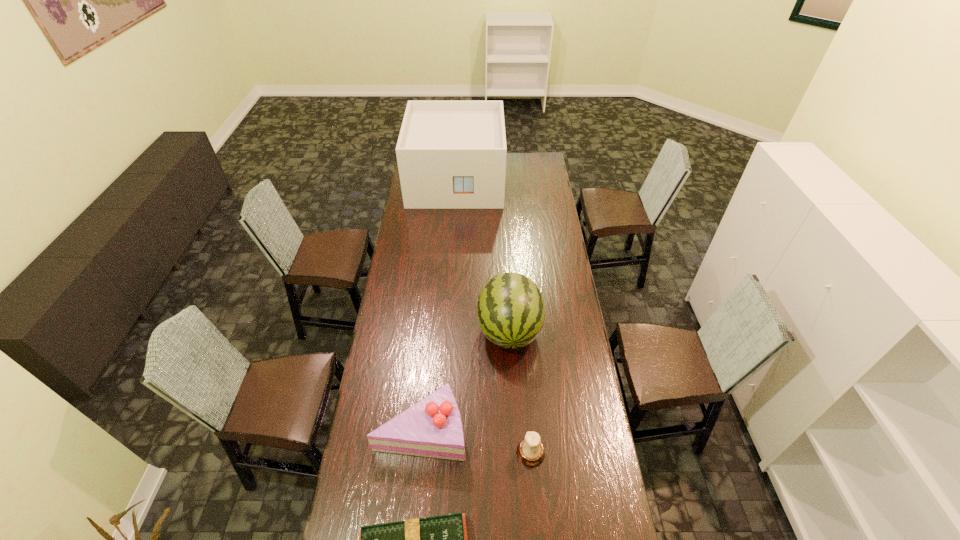
Identify the location of object located at the far edge. The image size is (960, 540). (451, 154).

The height and width of the screenshot is (540, 960). I want to click on box located at the left edge, so click(451, 154).

Where is `cake that is at the left edge`? This screenshot has width=960, height=540. cake that is at the left edge is located at coordinates (432, 427).

The image size is (960, 540). In order to click on object that is positioned at the far left corner in this screenshot , I will do `click(451, 154)`.

The height and width of the screenshot is (540, 960). Identify the location of vacant area at the far edge. (508, 152).

What are the coordinates of `vacant space at the left edge of the desktop` in the screenshot? It's located at (397, 251).

What are the coordinates of `free spot at the right edge of the desktop` in the screenshot? It's located at (540, 258).

Locate an element on the screen. free space between the cake and the tallest object is located at coordinates (439, 305).

The width and height of the screenshot is (960, 540). Find the location of `empty space that is in between the third shortest object and the box`. empty space that is in between the third shortest object and the box is located at coordinates (439, 305).

This screenshot has height=540, width=960. Identify the location of free area in between the farthest object and the fourth nearest object. (483, 255).